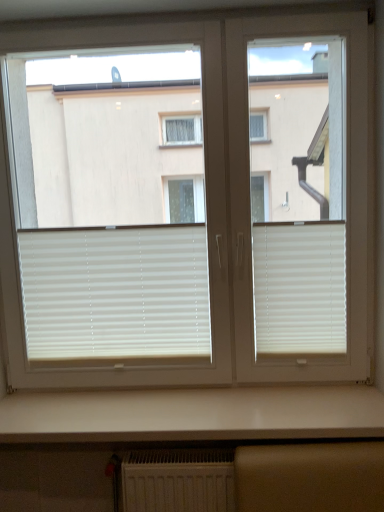
Question: Can you confirm if white glossy counter top at lower center is shorter than white matte blinds at center?

Choices:
 (A) no
 (B) yes

Answer: (B)

Question: From a real-world perspective, is white glossy counter top at lower center on white matte blinds at center?

Choices:
 (A) yes
 (B) no

Answer: (B)

Question: Considering the relative sizes of white glossy counter top at lower center and white matte blinds at center in the image provided, is white glossy counter top at lower center smaller than white matte blinds at center?

Choices:
 (A) yes
 (B) no

Answer: (A)

Question: Considering the relative sizes of white glossy counter top at lower center and white matte blinds at center in the image provided, is white glossy counter top at lower center taller than white matte blinds at center?

Choices:
 (A) no
 (B) yes

Answer: (A)

Question: Is white glossy counter top at lower center bigger than white matte blinds at center?

Choices:
 (A) no
 (B) yes

Answer: (A)

Question: Would you say white matte blinds at right, positioned as the first window blind in right-to-left order, is inside or outside white matte blinds at center?

Choices:
 (A) inside
 (B) outside

Answer: (A)

Question: Considering the relative positions of white matte blinds at right, positioned as the first window blind in right-to-left order, and white matte blinds at center in the image provided, is white matte blinds at right, positioned as the first window blind in right-to-left order, to the left or to the right of white matte blinds at center?

Choices:
 (A) right
 (B) left

Answer: (A)

Question: In terms of width, does white matte blinds at right, arranged as the 2th window blind when viewed from the left, look wider or thinner when compared to white matte blinds at center?

Choices:
 (A) thin
 (B) wide

Answer: (A)

Question: From the image's perspective, is white matte blinds at right, arranged as the 2th window blind when viewed from the left, above or below white matte blinds at center?

Choices:
 (A) above
 (B) below

Answer: (B)

Question: From the image's perspective, is white matte blinds at center positioned above or below white matte blinds at center?

Choices:
 (A) above
 (B) below

Answer: (A)

Question: In the image, is white matte blinds at center positioned in front of or behind white matte blinds at center?

Choices:
 (A) front
 (B) behind

Answer: (A)

Question: Is white matte blinds at center bigger or smaller than white matte blinds at center?

Choices:
 (A) big
 (B) small

Answer: (B)

Question: From a real-world perspective, is white matte blinds at center positioned above or below white matte blinds at center?

Choices:
 (A) below
 (B) above

Answer: (B)

Question: Relative to white matte blinds at center, marked as the 2th window blind in a right-to-left arrangement, is white glossy counter top at lower center in front or behind?

Choices:
 (A) front
 (B) behind

Answer: (A)

Question: Looking at their shapes, would you say white glossy counter top at lower center is wider or thinner than white matte blinds at center, marked as the 2th window blind in a right-to-left arrangement?

Choices:
 (A) wide
 (B) thin

Answer: (A)